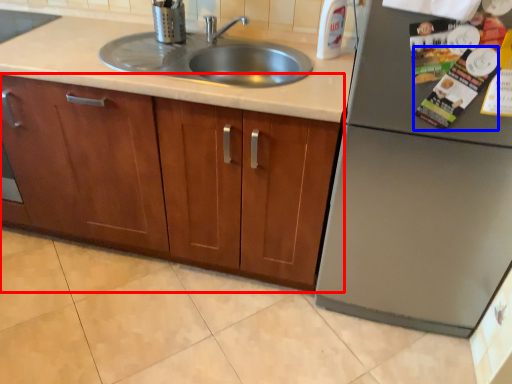
Question: Which object appears closest to the camera in this image, cabinetry (highlighted by a red box) or magazine (highlighted by a blue box)?

Choices:
 (A) cabinetry
 (B) magazine

Answer: (B)